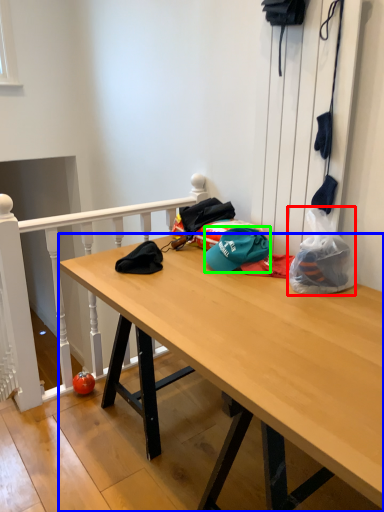
Question: Based on their relative distances, which object is nearer to plastic bag (highlighted by a red box)? Choose from desk (highlighted by a blue box) and hat (highlighted by a green box).

Choices:
 (A) desk
 (B) hat

Answer: (B)